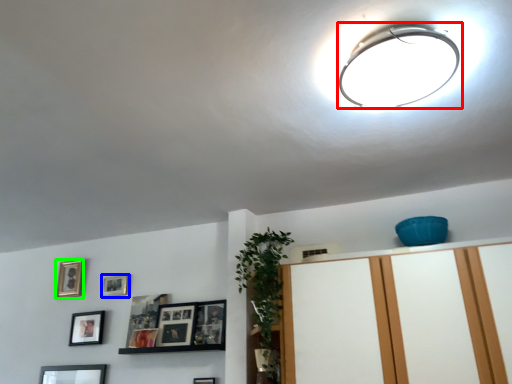
Question: Estimate the real-world distances between objects in this image. Which object is farther from lamp (highlighted by a red box), picture frame (highlighted by a blue box) or picture frame (highlighted by a green box)?

Choices:
 (A) picture frame
 (B) picture frame

Answer: (B)